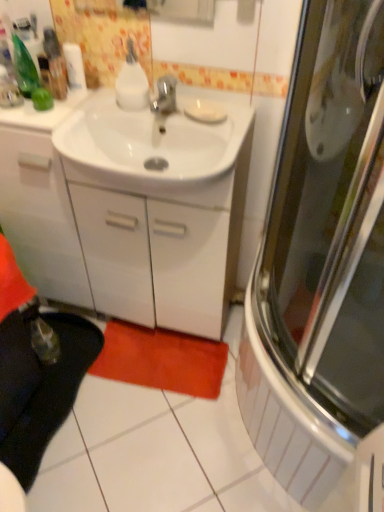
Question: In the image, is orange plush bath mat at lower center positioned in front of or behind white glossy sink at center?

Choices:
 (A) behind
 (B) front

Answer: (A)

Question: Considering the positions of orange plush bath mat at lower center and white glossy sink at center in the image, is orange plush bath mat at lower center taller or shorter than white glossy sink at center?

Choices:
 (A) short
 (B) tall

Answer: (A)

Question: Which of these objects is positioned closest to the black fabric carpet at lower left?

Choices:
 (A) translucent plastic bottle at upper left, which is counted as the first bottle, starting from the left
 (B) translucent plastic bottles at upper left
 (C) white glossy sink at center
 (D) white matte soap at center
 (E) white glossy bottle at upper center, the first bottle positioned from the right

Answer: (C)

Question: Considering the real-world distances, which object is closest to the translucent plastic bottles at upper left?

Choices:
 (A) orange plush bath mat at lower center
 (B) white glossy bottle at upper center, which ranks as the second bottle in left-to-right order
 (C) white matte toilet paper at upper left
 (D) translucent plastic bottle at upper left, which is counted as the first bottle, starting from the left
 (E) black fabric carpet at lower left

Answer: (D)